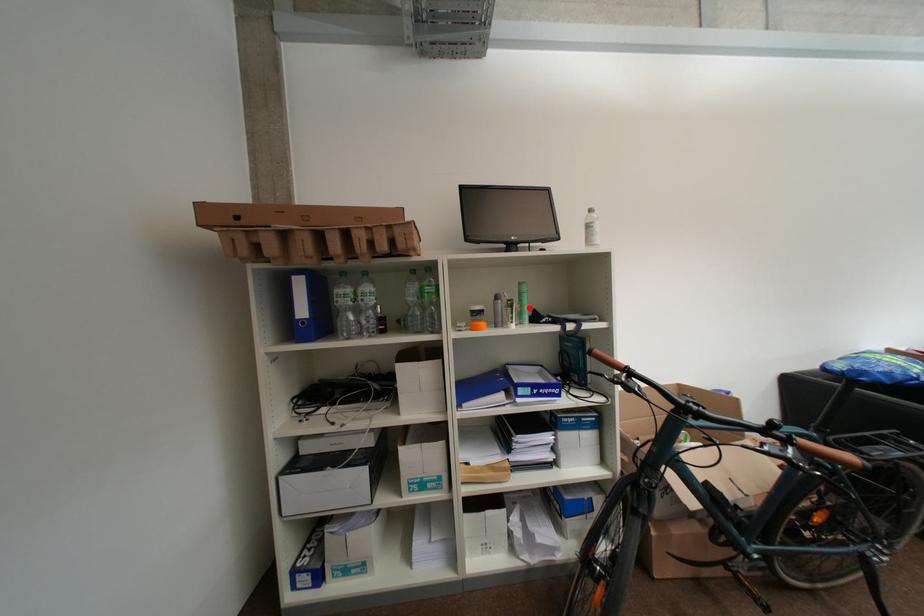
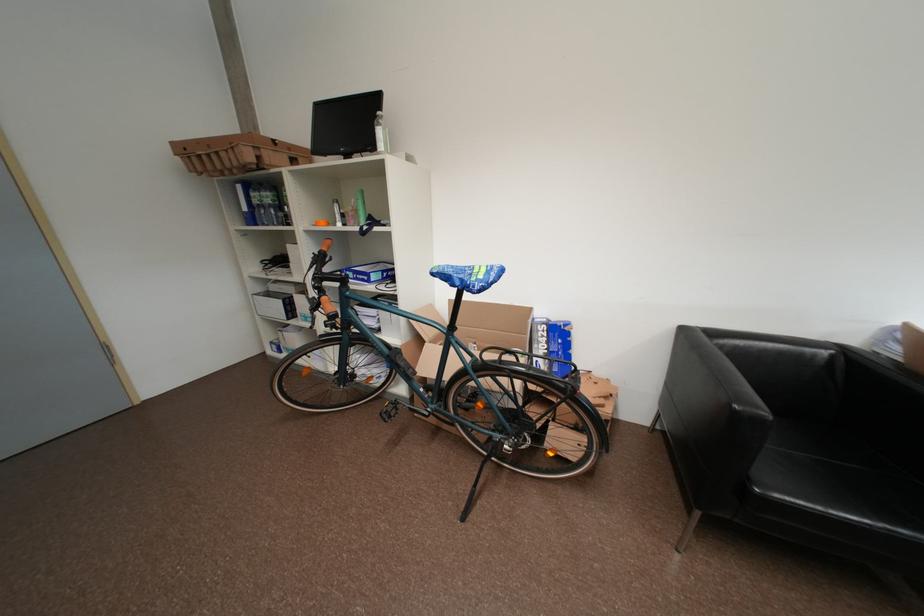
Question: I am providing you with two images of the same scene from different viewpoints. A red point is shown in image1. For the corresponding object point in image2, is it positioned nearer or farther from the camera?

Choices:
 (A) Nearer
 (B) Farther

Answer: (A)